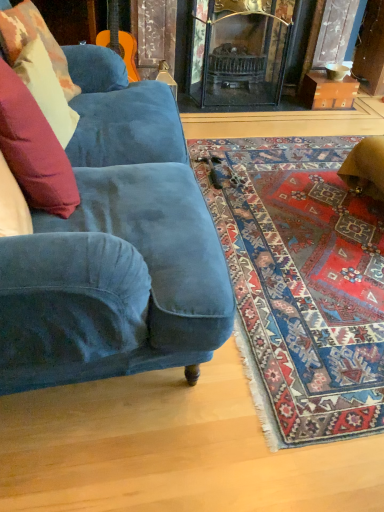
Question: From a real-world perspective, does velvet cushion at left, which is the 1th pillow in front-to-back order, stand above velvet cushion at left, which appears as the 2th pillow when viewed from the back?

Choices:
 (A) no
 (B) yes

Answer: (B)

Question: Does velvet cushion at left, which appears as the third pillow when viewed from the back, have a larger size compared to velvet cushion at left, the second pillow in the front-to-back sequence?

Choices:
 (A) yes
 (B) no

Answer: (A)

Question: Is velvet cushion at left, which appears as the third pillow when viewed from the back, completely or partially outside of velvet cushion at left, which appears as the 2th pillow when viewed from the back?

Choices:
 (A) yes
 (B) no

Answer: (A)

Question: Would you say velvet cushion at left, the second pillow in the front-to-back sequence, is part of velvet cushion at left, which is the 1th pillow in front-to-back order,'s contents?

Choices:
 (A) no
 (B) yes

Answer: (A)

Question: Does velvet cushion at left, which is the 1th pillow in front-to-back order, touch velvet cushion at left, which appears as the 2th pillow when viewed from the back?

Choices:
 (A) yes
 (B) no

Answer: (B)

Question: Is brown cardboard box at upper right wider or thinner than velvet cushion at left, which is the 1th pillow in front-to-back order?

Choices:
 (A) wide
 (B) thin

Answer: (A)

Question: Is brown cardboard box at upper right to the left or to the right of velvet cushion at left, which appears as the third pillow when viewed from the back, in the image?

Choices:
 (A) right
 (B) left

Answer: (A)

Question: From their relative heights in the image, would you say brown cardboard box at upper right is taller or shorter than velvet cushion at left, which is the 1th pillow in front-to-back order?

Choices:
 (A) short
 (B) tall

Answer: (A)

Question: Is brown cardboard box at upper right spatially inside velvet cushion at left, which is the 1th pillow in front-to-back order, or outside of it?

Choices:
 (A) outside
 (B) inside

Answer: (A)

Question: From a real-world perspective, is velvet cushion at left, placed as the first pillow when sorted from back to front, physically located above or below velvet cushion at left, which appears as the 2th pillow when viewed from the back?

Choices:
 (A) below
 (B) above

Answer: (B)

Question: Is velvet cushion at left, placed as the first pillow when sorted from back to front, spatially inside velvet cushion at left, the second pillow in the front-to-back sequence, or outside of it?

Choices:
 (A) inside
 (B) outside

Answer: (B)

Question: Considering their positions, is velvet cushion at left, the 3th pillow viewed from the front, located in front of or behind velvet cushion at left, which appears as the 2th pillow when viewed from the back?

Choices:
 (A) behind
 (B) front

Answer: (A)

Question: Considering the positions of point (21, 34) and point (66, 135), is point (21, 34) closer or farther from the camera than point (66, 135)?

Choices:
 (A) farther
 (B) closer

Answer: (B)

Question: Choose the correct answer: Is velvet cushion at left, the second pillow in the front-to-back sequence, inside brown cardboard box at upper right or outside it?

Choices:
 (A) outside
 (B) inside

Answer: (A)

Question: Is velvet cushion at left, which appears as the 2th pillow when viewed from the back, bigger or smaller than brown cardboard box at upper right?

Choices:
 (A) big
 (B) small

Answer: (A)